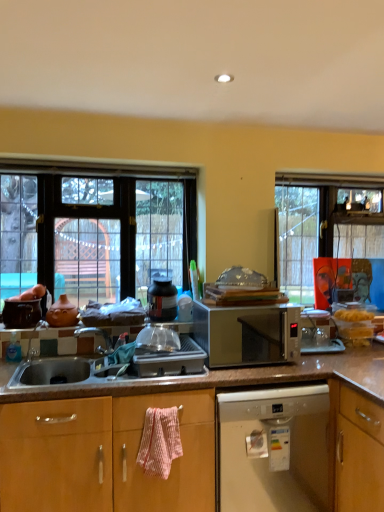
Question: From the image's perspective, is clear glass window at left located beneath silver metallic microwave at center?

Choices:
 (A) yes
 (B) no

Answer: (B)

Question: Is clear glass window at left oriented away from silver metallic microwave at center?

Choices:
 (A) yes
 (B) no

Answer: (B)

Question: Could you tell me if clear glass window at left is facing silver metallic microwave at center?

Choices:
 (A) no
 (B) yes

Answer: (B)

Question: Can you confirm if clear glass window at left is positioned to the left of silver metallic microwave at center?

Choices:
 (A) yes
 (B) no

Answer: (A)

Question: Does clear glass window at left have a lesser width compared to silver metallic microwave at center?

Choices:
 (A) yes
 (B) no

Answer: (A)

Question: Considering the relative positions of clear glass window at left and silver metallic microwave at center in the image provided, is clear glass window at left to the right of silver metallic microwave at center from the viewer's perspective?

Choices:
 (A) yes
 (B) no

Answer: (B)

Question: Considering the relative sizes of pink textured towel at lower center and matte black pot at center in the image provided, is pink textured towel at lower center thinner than matte black pot at center?

Choices:
 (A) yes
 (B) no

Answer: (B)

Question: Would you say matte black pot at center is part of pink textured towel at lower center's contents?

Choices:
 (A) yes
 (B) no

Answer: (B)

Question: From the image's perspective, is pink textured towel at lower center above matte black pot at center?

Choices:
 (A) yes
 (B) no

Answer: (B)

Question: Is pink textured towel at lower center next to matte black pot at center?

Choices:
 (A) yes
 (B) no

Answer: (B)

Question: Is pink textured towel at lower center outside matte black pot at center?

Choices:
 (A) yes
 (B) no

Answer: (A)

Question: From a real-world perspective, is pink textured towel at lower center positioned over matte black pot at center based on gravity?

Choices:
 (A) no
 (B) yes

Answer: (A)

Question: From the image's perspective, would you say silver metallic microwave at center is shown under clear glass window at left?

Choices:
 (A) no
 (B) yes

Answer: (B)